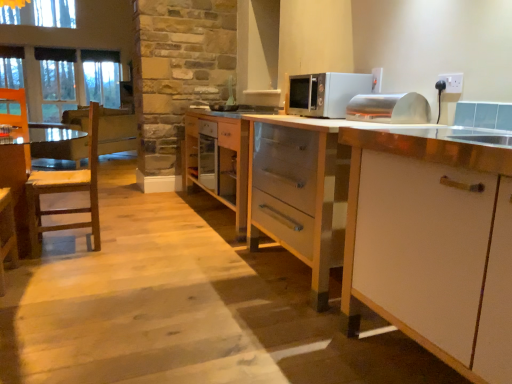
Question: Is white plastic electric outlet at upper right not within clear glass window at upper left?

Choices:
 (A) no
 (B) yes

Answer: (B)

Question: Is white plastic electric outlet at upper right to the left of clear glass window at upper left from the viewer's perspective?

Choices:
 (A) no
 (B) yes

Answer: (A)

Question: Is white plastic electric outlet at upper right oriented towards clear glass window at upper left?

Choices:
 (A) no
 (B) yes

Answer: (A)

Question: Does white plastic electric outlet at upper right appear on the right side of clear glass window at upper left?

Choices:
 (A) no
 (B) yes

Answer: (B)

Question: Is white plastic electric outlet at upper right in contact with clear glass window at upper left?

Choices:
 (A) no
 (B) yes

Answer: (A)

Question: From the image's perspective, is white wood drawer at center located above or below clear glass window at upper left?

Choices:
 (A) above
 (B) below

Answer: (B)

Question: Is point (229, 182) closer or farther from the camera than point (73, 82)?

Choices:
 (A) closer
 (B) farther

Answer: (A)

Question: From a real-world perspective, is white wood drawer at center above or below clear glass window at upper left?

Choices:
 (A) below
 (B) above

Answer: (A)

Question: Visually, is white wood drawer at center positioned to the left or to the right of clear glass window at upper left?

Choices:
 (A) right
 (B) left

Answer: (A)

Question: Looking at their shapes, would you say white glossy counter top at center is wider or thinner than wooden cabinet at center, placed as the third cabinetry when sorted from front to back?

Choices:
 (A) thin
 (B) wide

Answer: (B)

Question: Is white glossy counter top at center situated inside wooden cabinet at center, placed as the 1th cabinetry when sorted from back to front, or outside?

Choices:
 (A) outside
 (B) inside

Answer: (A)

Question: In terms of size, does white glossy counter top at center appear bigger or smaller than wooden cabinet at center, placed as the third cabinetry when sorted from front to back?

Choices:
 (A) big
 (B) small

Answer: (A)

Question: Would you say white glossy counter top at center is to the left or to the right of wooden cabinet at center, placed as the third cabinetry when sorted from front to back, in the picture?

Choices:
 (A) right
 (B) left

Answer: (B)

Question: Relative to white wood drawer at center, is wooden cabinet at center, placed as the 1th cabinetry when sorted from back to front, in front or behind?

Choices:
 (A) front
 (B) behind

Answer: (A)

Question: Is wooden cabinet at center, placed as the third cabinetry when sorted from front to back, bigger or smaller than white wood drawer at center?

Choices:
 (A) small
 (B) big

Answer: (B)